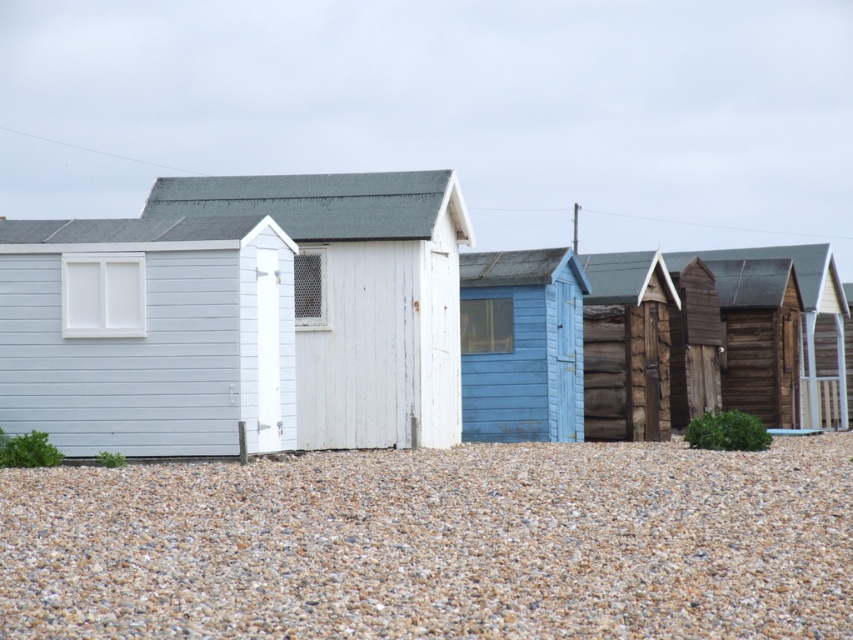
Looking at this image, can you confirm if brown pebbled gravel at lower center is positioned to the left of white wooden beach hut at center?

Incorrect, brown pebbled gravel at lower center is not on the left side of white wooden beach hut at center.

Between brown pebbled gravel at lower center and white wooden beach hut at center, which one has more height?

brown pebbled gravel at lower center

Between point (68, 570) and point (289, 419), which one is positioned in front?

Point (68, 570)

You are a GUI agent. You are given a task and a screenshot of the screen. Output one action in this format:
    pyautogui.click(x=<x>, y=<y>)
    Task: Click on the brown pebbled gravel at lower center
    Image resolution: width=853 pixels, height=640 pixels.
    Given the screenshot: What is the action you would take?
    pyautogui.click(x=437, y=544)

Does brown pebbled gravel at lower center have a smaller size compared to wooden cabin at center?

Indeed, brown pebbled gravel at lower center has a smaller size compared to wooden cabin at center.

Locate an element on the screen. The height and width of the screenshot is (640, 853). brown pebbled gravel at lower center is located at coordinates (437, 544).

Does point (538, 552) lie behind point (807, 332)?

No, (538, 552) is closer to viewer.

This screenshot has height=640, width=853. What are the coordinates of `brown pebbled gravel at lower center` in the screenshot? It's located at (437, 544).

Can you confirm if white wooden beach hut at center is shorter than light blue wooden hut at center?

Indeed, white wooden beach hut at center has a lesser height compared to light blue wooden hut at center.

Is white wooden beach hut at center closer to the viewer compared to light blue wooden hut at center?

Yes, white wooden beach hut at center is in front of light blue wooden hut at center.

Does point (349, 260) come behind point (521, 328)?

No.

Identify the location of white wooden beach hut at center. (239, 317).